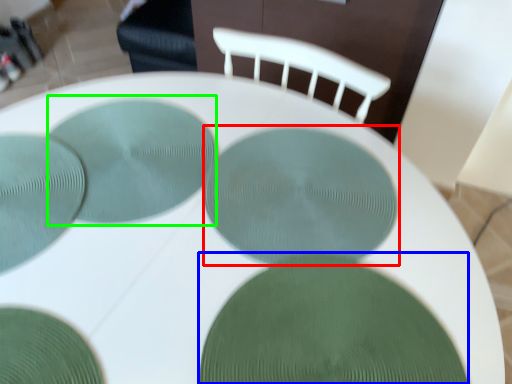
Question: Based on their relative distances, which object is farther from glass plate (highlighted by a red box)? Choose from glass plate (highlighted by a blue box) and glass plate (highlighted by a green box).

Choices:
 (A) glass plate
 (B) glass plate

Answer: (B)